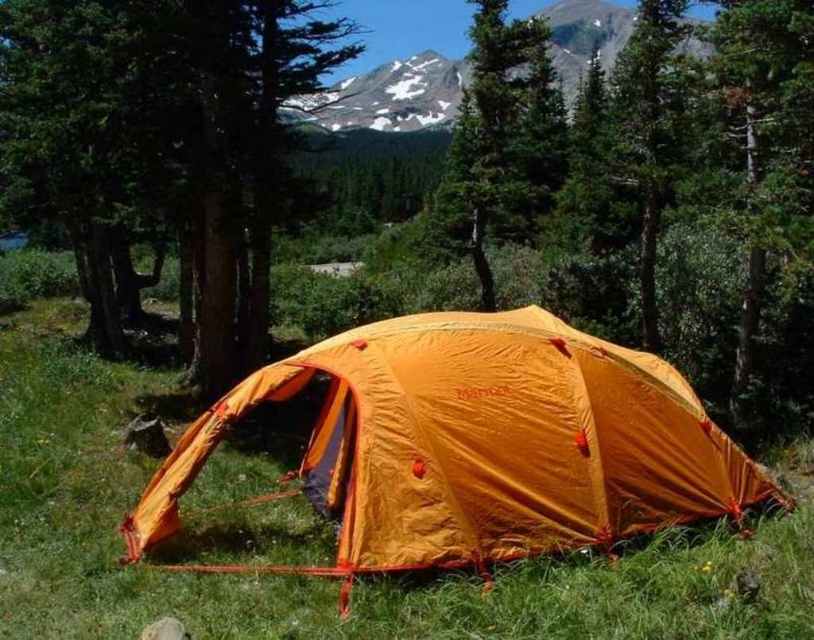
Question: Does green matte tree at center lie in front of snowy rock at upper center?

Choices:
 (A) no
 (B) yes

Answer: (B)

Question: Which point is farther to the camera?

Choices:
 (A) green matte tree at center
 (B) snowy rock at upper center

Answer: (B)

Question: Which point is closer to the camera?

Choices:
 (A) (565, 76)
 (B) (257, 173)

Answer: (B)

Question: Does orange nylon tent at center appear over snowy rock at upper center?

Choices:
 (A) no
 (B) yes

Answer: (A)

Question: Is orange nylon tent at center below green matte tree at center?

Choices:
 (A) no
 (B) yes

Answer: (B)

Question: Which point appears farthest from the camera in this image?

Choices:
 (A) (322, 77)
 (B) (572, 35)

Answer: (B)